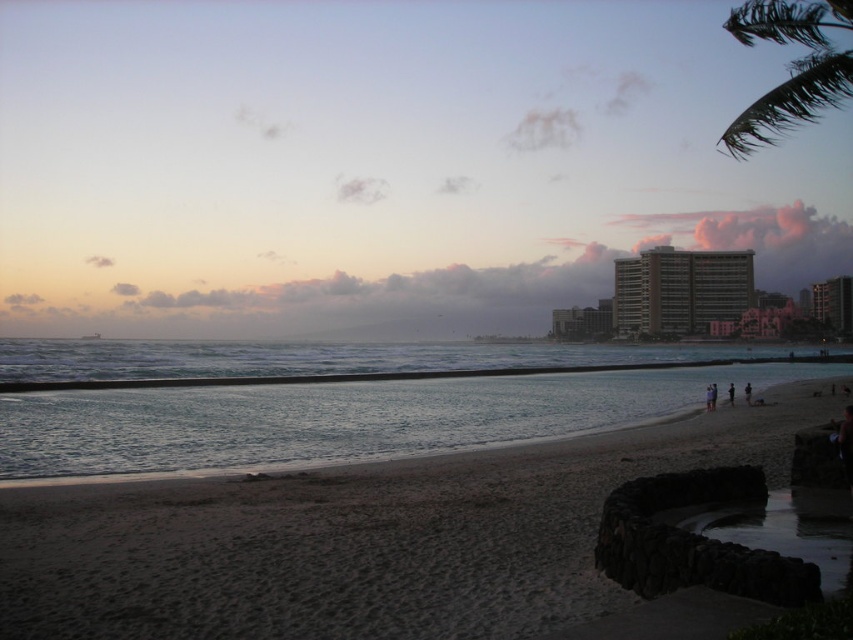
You are standing on the beach and want to take a photo of the clear blue water at center. If your camera can focus on objects up to 50 feet away, will you need to move closer to take a clear photo?

The clear blue water at center is 56.55 feet away from the camera, which is beyond the camera focus range of 50 feet. Therefore, you need to move closer to ensure the clear blue water at center is within the focus range.

You are a photographer trying to capture a clear shot of the dark skin textured person at lower right and the dark blue fabric at lower right. Based on their positions, which object is closer to the camera?

The dark skin textured person at lower right is behind the dark blue fabric at lower right, meaning the dark blue fabric at lower lower right is closer to the camera.

Based on the photo, you are a photographer standing on the beach and want to capture both the dark blue fabric at lower right and the dark skin textured person at lower right in the same frame. Given that your camera has a 1.1 meter focal length, will you be able to include both subjects in the photo?

The dark blue fabric at lower right and the dark skin textured person at lower right are 1.14 meters apart. Since the camera has a 1.1 meter focal length, which is slightly shorter than the distance between the two subjects, you might need to adjust your position or zoom out slightly to ensure both are in the frame.